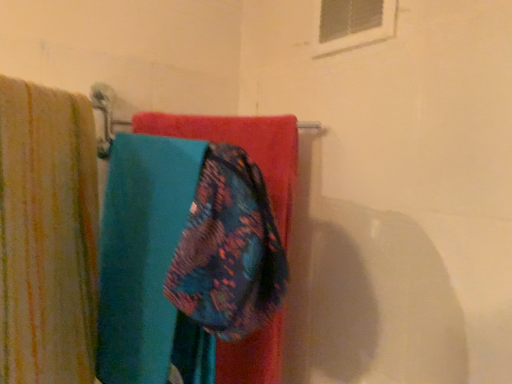
Question: From the image's perspective, is striped cotton towel at left positioned above or below floral fabric towel at center?

Choices:
 (A) above
 (B) below

Answer: (B)

Question: From their relative heights in the image, would you say striped cotton towel at left is taller or shorter than floral fabric towel at center?

Choices:
 (A) short
 (B) tall

Answer: (B)

Question: Which of these objects is positioned closest to the teal fabric towel at center?

Choices:
 (A) floral fabric towel at center
 (B) striped cotton towel at left
 (C) white plastic window at upper center

Answer: (B)

Question: Which of these objects is positioned farthest from the white plastic window at upper center?

Choices:
 (A) floral fabric towel at center
 (B) striped cotton towel at left
 (C) teal fabric towel at center

Answer: (B)